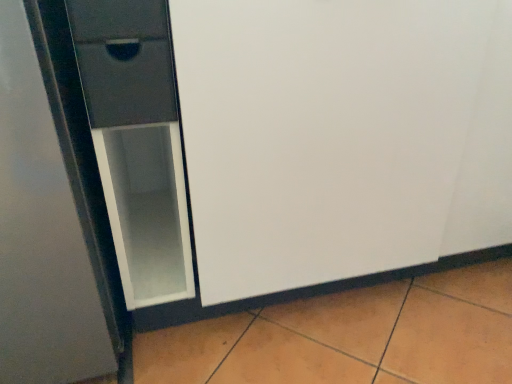
Question: Would you say matte black drawer at left, which appears as the 1th drawer when ordered from the bottom, is part of matte black drawer at upper left, the 1th drawer when ordered from top to bottom,'s contents?

Choices:
 (A) no
 (B) yes

Answer: (A)

Question: Is matte black drawer at upper left, the second drawer from the bottom, shorter than matte black drawer at left, which is the 2th drawer from top to bottom?

Choices:
 (A) yes
 (B) no

Answer: (A)

Question: Is matte black drawer at upper left, the second drawer from the bottom, directly adjacent to matte black drawer at left, which is the 2th drawer from top to bottom?

Choices:
 (A) no
 (B) yes

Answer: (B)

Question: Can you confirm if matte black drawer at upper left, the second drawer from the bottom, is thinner than matte black drawer at left, which appears as the 1th drawer when ordered from the bottom?

Choices:
 (A) yes
 (B) no

Answer: (B)

Question: From the image's perspective, does matte black drawer at upper left, the 1th drawer when ordered from top to bottom, appear lower than matte black drawer at left, which is the 2th drawer from top to bottom?

Choices:
 (A) yes
 (B) no

Answer: (B)

Question: Does matte black drawer at upper left, the second drawer from the bottom, have a larger size compared to matte black drawer at left, which appears as the 1th drawer when ordered from the bottom?

Choices:
 (A) yes
 (B) no

Answer: (B)

Question: Is matte glass screen door at left surrounding matte black drawer at left, which appears as the 1th drawer when ordered from the bottom?

Choices:
 (A) no
 (B) yes

Answer: (B)

Question: Is matte glass screen door at left wider than matte black drawer at left, which appears as the 1th drawer when ordered from the bottom?

Choices:
 (A) no
 (B) yes

Answer: (B)

Question: From the image's perspective, is matte glass screen door at left below matte black drawer at left, which is the 2th drawer from top to bottom?

Choices:
 (A) yes
 (B) no

Answer: (A)

Question: Can we say matte glass screen door at left lies outside matte black drawer at left, which is the 2th drawer from top to bottom?

Choices:
 (A) no
 (B) yes

Answer: (B)

Question: Considering the relative sizes of matte glass screen door at left and matte black drawer at left, which appears as the 1th drawer when ordered from the bottom, in the image provided, is matte glass screen door at left smaller than matte black drawer at left, which appears as the 1th drawer when ordered from the bottom,?

Choices:
 (A) no
 (B) yes

Answer: (A)

Question: Is matte glass screen door at left far away from matte black drawer at left, which is the 2th drawer from top to bottom?

Choices:
 (A) yes
 (B) no

Answer: (B)

Question: From a real-world perspective, is matte black drawer at upper left, the 1th drawer when ordered from top to bottom, on matte glass screen door at left?

Choices:
 (A) no
 (B) yes

Answer: (B)